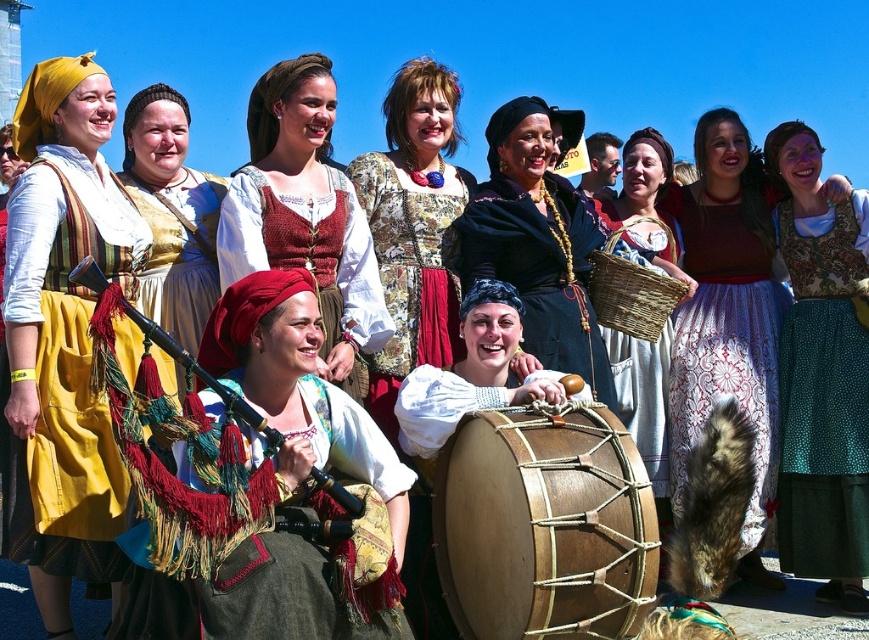
In the scene shown: You are standing in the middle of the crowd watching the cultural event. You see the natural wood drum at center and the matte wicker basket at center. Which one is positioned to the left of the other?

The natural wood drum at center is positioned to the left of the matte wicker basket at center.